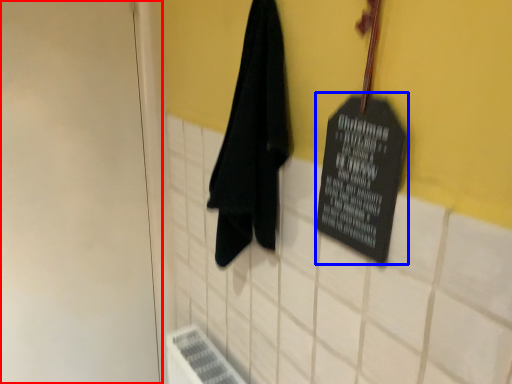
Question: Which of the following is the farthest to the observer, door (highlighted by a red box) or bulletin board (highlighted by a blue box)?

Choices:
 (A) door
 (B) bulletin board

Answer: (A)